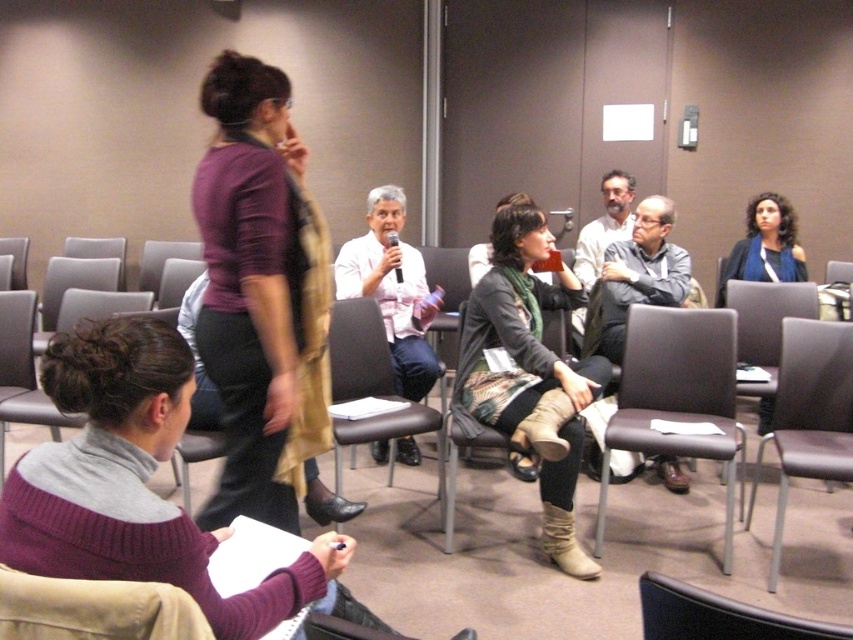
Question: Which point appears closest to the camera in this image?

Choices:
 (A) (136, 301)
 (B) (404, 374)
 (C) (258, 118)
 (D) (12, 272)

Answer: (C)

Question: Which point is closer to the camera taking this photo?

Choices:
 (A) [x=424, y=344]
 (B) [x=444, y=480]
 (C) [x=18, y=280]
 (D) [x=674, y=413]

Answer: (D)

Question: Does gray fabric shirt at center appear on the right side of gray fabric jacket at center?

Choices:
 (A) yes
 (B) no

Answer: (A)

Question: Where is pink fabric shirt at center located in relation to brown leather chair at lower left in the image?

Choices:
 (A) above
 (B) below

Answer: (A)

Question: Among these points, which one is farthest from the camera?

Choices:
 (A) (846, 342)
 (B) (68, 621)
 (C) (718, 360)
 (D) (601, 323)

Answer: (D)

Question: Is green scarf at center to the right of dark gray sweater at center from the viewer's perspective?

Choices:
 (A) yes
 (B) no

Answer: (B)